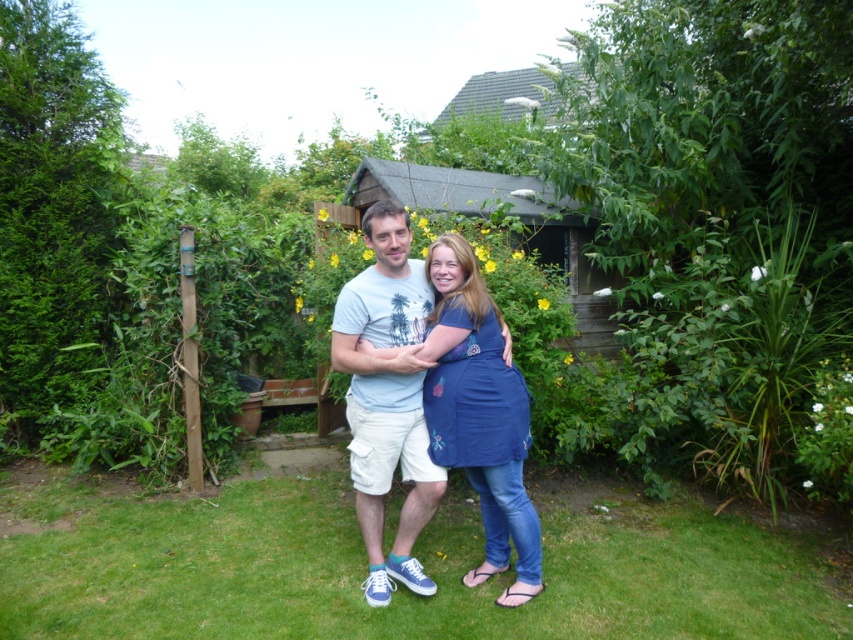
Question: Among these points, which one is nearest to the camera?

Choices:
 (A) (102, 609)
 (B) (515, 490)

Answer: (A)

Question: Does green grass at lower center appear over white cotton t-shirt at center?

Choices:
 (A) yes
 (B) no

Answer: (B)

Question: Where is green grass at lower center located in relation to white cotton t-shirt at center in the image?

Choices:
 (A) right
 (B) left

Answer: (B)

Question: Which is farther from the blue cotton apron at center?

Choices:
 (A) blue denim jeans at center
 (B) green grass at lower center
 (C) white cotton t-shirt at center

Answer: (B)

Question: In this image, where is blue denim jeans at center located relative to blue cotton apron at center?

Choices:
 (A) below
 (B) above

Answer: (A)

Question: Which point is closer to the camera taking this photo?

Choices:
 (A) (170, 500)
 (B) (512, 596)
 (C) (374, 524)
 (D) (456, 436)

Answer: (D)